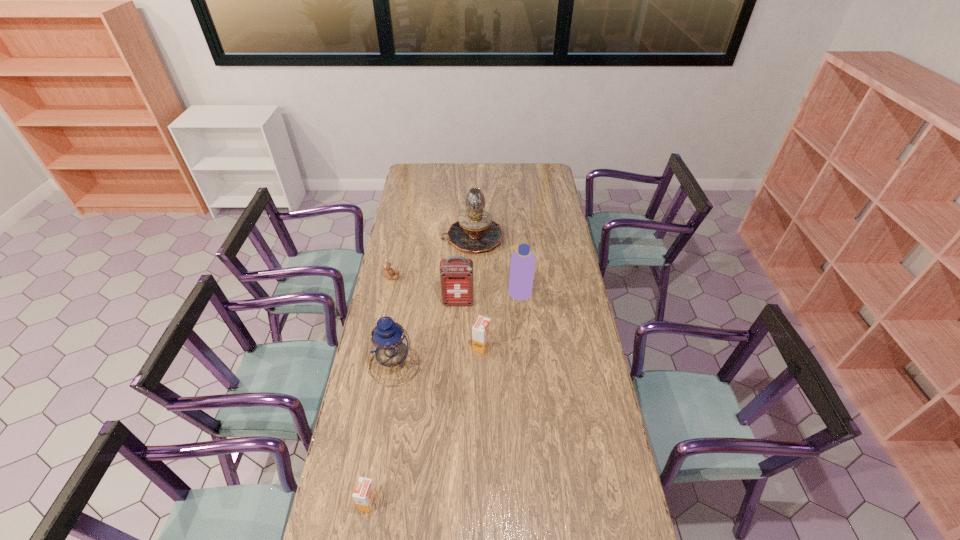
Please point a vacant point for placing a orange juice on the right. Please provide its 2D coordinates. Your answer should be formatted as a tuple, i.e. [(x, y)], where the tuple contains the x and y coordinates of a point satisfying the conditions above.

[(551, 251)]